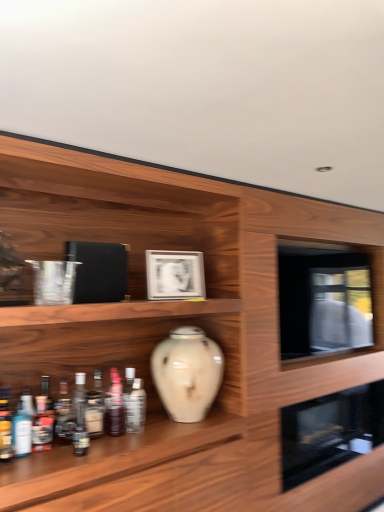
Question: In terms of width, does translucent plastic bottle at center, the 1th bottle from the right, look wider or thinner when compared to translucent glass bottle at lower left, which is counted as the second bottle, starting from the right?

Choices:
 (A) wide
 (B) thin

Answer: (A)

Question: Considering the positions of translucent plastic bottle at center, the 1th bottle from the right, and translucent glass bottle at lower left, which is counted as the second bottle, starting from the right, in the image, is translucent plastic bottle at center, the 1th bottle from the right, taller or shorter than translucent glass bottle at lower left, which is counted as the second bottle, starting from the right,?

Choices:
 (A) tall
 (B) short

Answer: (B)

Question: Estimate the real-world distances between objects in this image. Which object is closer to the translucent glass bottle at lower left, the 5th bottle when ordered from left to right?

Choices:
 (A) translucent glass bottle at lower left, the seventh bottle from the right
 (B) black glass oven at lower right, marked as the 2th oven in a top-to-bottom arrangement
 (C) matte silver picture frame at center
 (D) translucent glass bottle at lower left, which is counted as the third bottle, starting from the left
 (E) translucent glass bottle at lower left, positioned as the 7th bottle in left-to-right order

Answer: (D)

Question: Which object is positioned farthest from the black glass oven at lower right, marked as the 2th oven in a top-to-bottom arrangement?

Choices:
 (A) white glossy vase at center
 (B) translucent glass bottle at lower left, which is counted as the second bottle, starting from the right
 (C) matte silver picture frame at center
 (D) translucent plastic bottle at center, acting as the 8th bottle starting from the left
 (E) translucent glass bottle at lower left, the 5th bottle when ordered from left to right

Answer: (E)